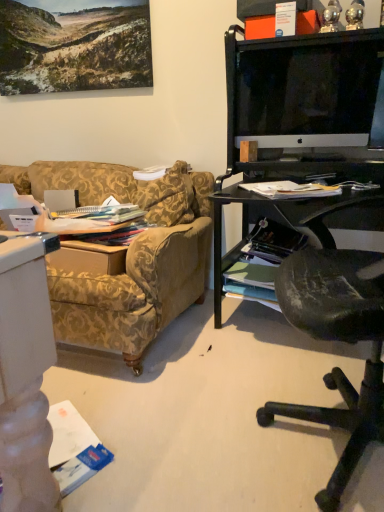
Question: Does shiny metallic magazine at lower right, which is counted as the 1th magazine, starting from the back, have a greater height compared to white paper magazine at right, marked as the first magazine in a top-to-bottom arrangement?

Choices:
 (A) yes
 (B) no

Answer: (A)

Question: Is shiny metallic magazine at lower right, which is the second magazine from top to bottom, thinner than white paper magazine at right, arranged as the 2th magazine when ordered from the bottom?

Choices:
 (A) no
 (B) yes

Answer: (A)

Question: Does shiny metallic magazine at lower right, arranged as the first magazine when ordered from the bottom, come in front of white paper magazine at right, placed as the second magazine when sorted from back to front?

Choices:
 (A) no
 (B) yes

Answer: (A)

Question: Can you confirm if shiny metallic magazine at lower right, which is counted as the 1th magazine, starting from the back, is bigger than white paper magazine at right, placed as the second magazine when sorted from back to front?

Choices:
 (A) yes
 (B) no

Answer: (A)

Question: Is shiny metallic magazine at lower right, arranged as the first magazine when ordered from the bottom, aimed at white paper magazine at right, the first magazine when ordered from front to back?

Choices:
 (A) no
 (B) yes

Answer: (A)

Question: Is shiny metallic magazine at lower right, which is counted as the 1th magazine, starting from the back, oriented away from white paper magazine at right, arranged as the 2th magazine when ordered from the bottom?

Choices:
 (A) yes
 (B) no

Answer: (B)

Question: Is white paper magazine at right, the first magazine when ordered from front to back, thinner than white glossy monitor at upper right?

Choices:
 (A) yes
 (B) no

Answer: (B)

Question: From a real-world perspective, is white paper magazine at right, the first magazine when ordered from front to back, on white glossy monitor at upper right?

Choices:
 (A) no
 (B) yes

Answer: (A)

Question: Is white glossy monitor at upper right surrounded by white paper magazine at right, placed as the second magazine when sorted from back to front?

Choices:
 (A) no
 (B) yes

Answer: (A)

Question: Is white paper magazine at right, the first magazine when ordered from front to back, facing away from white glossy monitor at upper right?

Choices:
 (A) no
 (B) yes

Answer: (A)

Question: Is white paper magazine at right, marked as the first magazine in a top-to-bottom arrangement, at the left side of white glossy monitor at upper right?

Choices:
 (A) yes
 (B) no

Answer: (A)

Question: Is white paper magazine at right, marked as the first magazine in a top-to-bottom arrangement, outside of white glossy monitor at upper right?

Choices:
 (A) no
 (B) yes

Answer: (B)

Question: Does white paper magazine at right, the first magazine when ordered from front to back, appear on the left side of shiny metallic magazine at lower right, which is counted as the 1th magazine, starting from the back?

Choices:
 (A) no
 (B) yes

Answer: (B)